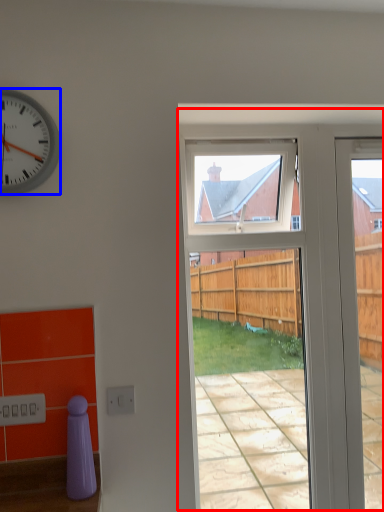
Question: Which object is further to the camera taking this photo, screen door (highlighted by a red box) or clock (highlighted by a blue box)?

Choices:
 (A) screen door
 (B) clock

Answer: (A)